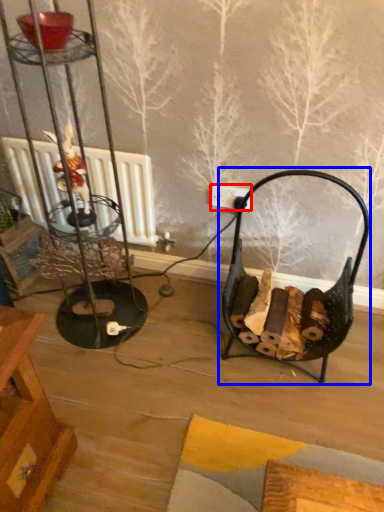
Question: Which object is closer to the camera taking this photo, electric outlet (highlighted by a red box) or armchair (highlighted by a blue box)?

Choices:
 (A) electric outlet
 (B) armchair

Answer: (B)